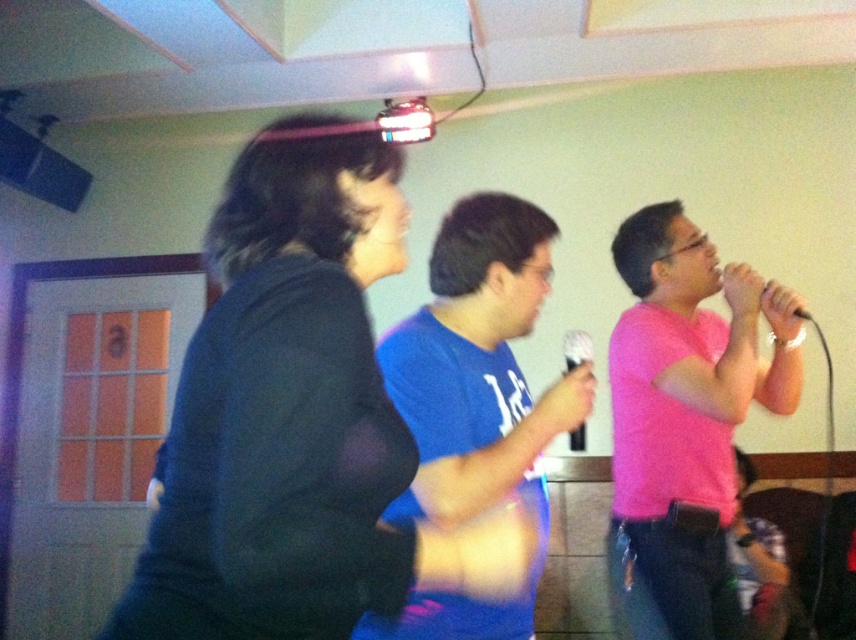
Based on the photo, who is more forward, (336, 500) or (580, 348)?

Point (336, 500) is more forward.

Is point (211, 401) closer to camera compared to point (581, 333)?

Yes, point (211, 401) is closer to viewer.

Is point (169, 593) less distant than point (580, 337)?

Yes, point (169, 593) is in front of point (580, 337).

Find the location of a particular element. This screenshot has width=856, height=640. black matte shirt at upper left is located at coordinates (298, 422).

How much distance is there between black matte shirt at upper left and matte black microphone at upper right?

black matte shirt at upper left is 3.40 feet from matte black microphone at upper right.

Does black matte shirt at upper left appear under matte black microphone at upper right?

Yes.

Between point (223, 582) and point (724, 300), which one is positioned in front?

Point (223, 582)

Where is `black matte shirt at upper left`? The height and width of the screenshot is (640, 856). black matte shirt at upper left is located at coordinates (298, 422).

Measure the distance from blue cotton shirt at center to black plastic microphone at center.

blue cotton shirt at center is 15.60 inches from black plastic microphone at center.

Who is more distant from viewer, (501, 266) or (572, 436)?

Point (572, 436)

The width and height of the screenshot is (856, 640). Identify the location of blue cotton shirt at center. (474, 401).